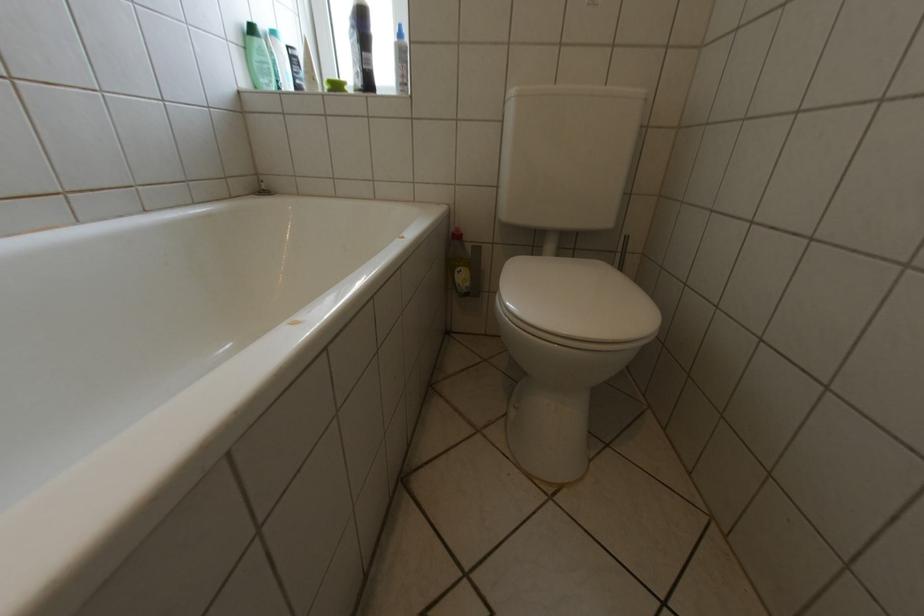
Identify the location of dark spray bottle. Image resolution: width=924 pixels, height=616 pixels. (360, 47).